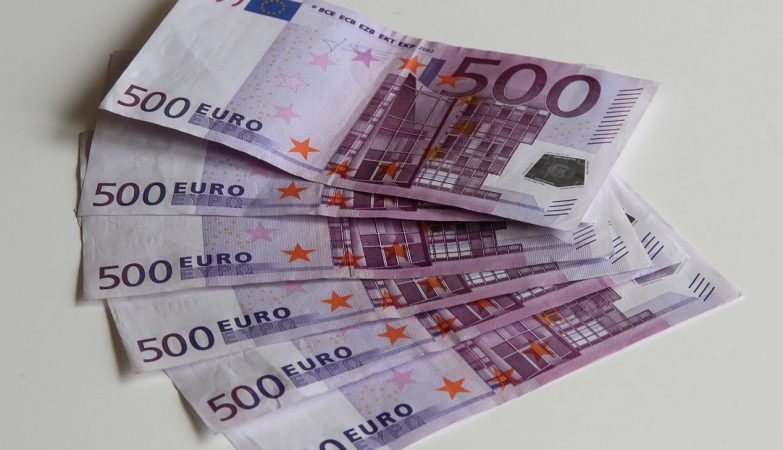
This screenshot has width=783, height=450. What are the coordinates of `table` in the screenshot? It's located at (694, 403).